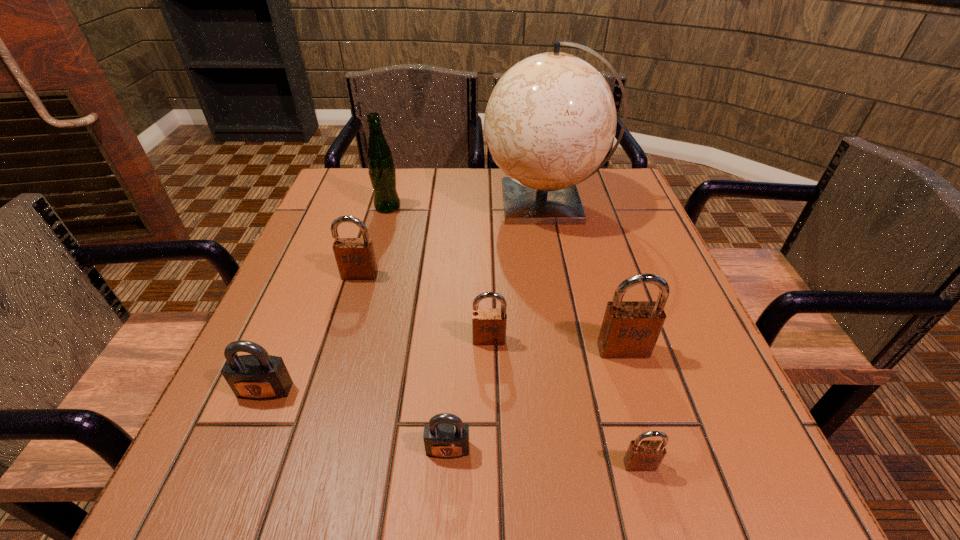
You are a GUI agent. You are given a task and a screenshot of the screen. Output one action in this format:
    pyautogui.click(x=<x>, y=<y>)
    Task: Click on the farther gray padlock
    Image resolution: width=960 pixels, height=540 pixels.
    Given the screenshot: What is the action you would take?
    pyautogui.click(x=259, y=376)

Where is `the leftmost object`? This screenshot has width=960, height=540. the leftmost object is located at coordinates (259, 376).

This screenshot has height=540, width=960. Identify the location of the right gray padlock. (445, 436).

Locate an element on the screen. Image resolution: width=960 pixels, height=540 pixels. the fifth object from right to left is located at coordinates (445, 436).

Identify the location of the smallest brown padlock. (642, 455).

You are a GUI agent. You are given a task and a screenshot of the screen. Output one action in this format:
    pyautogui.click(x=<x>, y=<y>)
    Task: Click on the blank space located 0.060m on the surface of the tallest object showing Europe and Africa
    The width and height of the screenshot is (960, 540).
    Given the screenshot: What is the action you would take?
    pyautogui.click(x=460, y=202)

Find the location of a particular element. The height and width of the screenshot is (540, 960). blank space located 0.260m on the surface of the tallest object showing Europe and Africa is located at coordinates (383, 202).

Locate an element on the screen. vacant space situated 0.200m on the surface of the tallest object showing Europe and Africa is located at coordinates (406, 202).

In order to click on vacant space located 0.080m on the back of the beer bottle in this screenshot , I will do `click(395, 184)`.

Where is `free space located on the front-facing side of the tallest padlock`? free space located on the front-facing side of the tallest padlock is located at coordinates (660, 472).